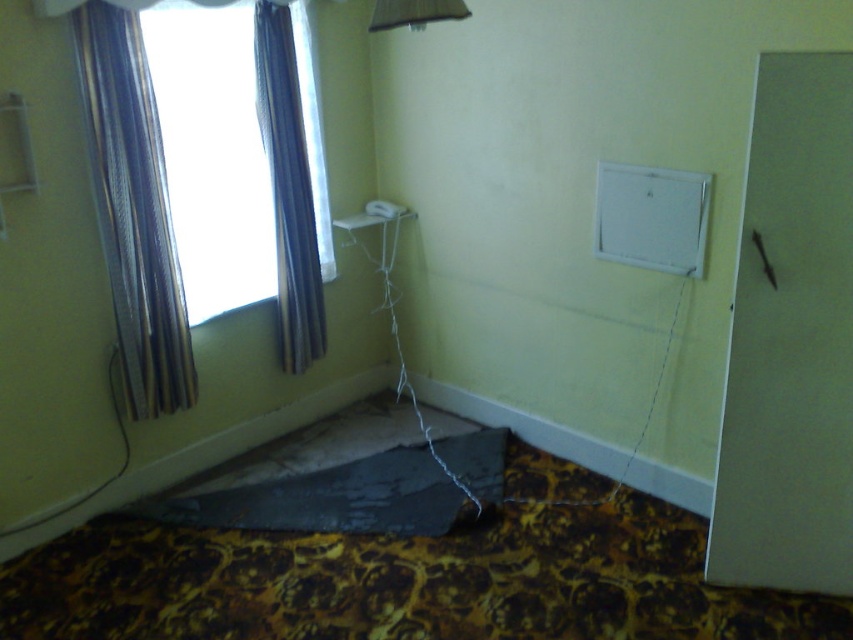
Question: Which of the following is the farthest from the observer?

Choices:
 (A) (289, 170)
 (B) (193, 38)
 (C) (161, 196)

Answer: (A)

Question: Which object appears closest to the camera in this image?

Choices:
 (A) satin fabric curtain at upper left
 (B) metallic fabric curtain at left
 (C) transparent glass window at upper left

Answer: (B)

Question: Among these points, which one is farthest from the camera?

Choices:
 (A) (286, 358)
 (B) (126, 193)
 (C) (236, 40)

Answer: (A)

Question: In this image, where is transparent glass window at upper left located relative to metallic fabric curtain at left?

Choices:
 (A) above
 (B) below

Answer: (A)

Question: Where is metallic fabric curtain at left located in relation to satin fabric curtain at upper left in the image?

Choices:
 (A) left
 (B) right

Answer: (A)

Question: Is transparent glass window at upper left behind metallic fabric curtain at left?

Choices:
 (A) yes
 (B) no

Answer: (A)